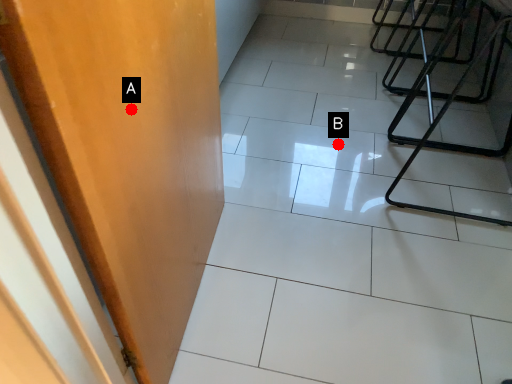
Question: Two points are circled on the image, labeled by A and B beside each circle. Which point is further to the camera?

Choices:
 (A) A is further
 (B) B is further

Answer: (B)